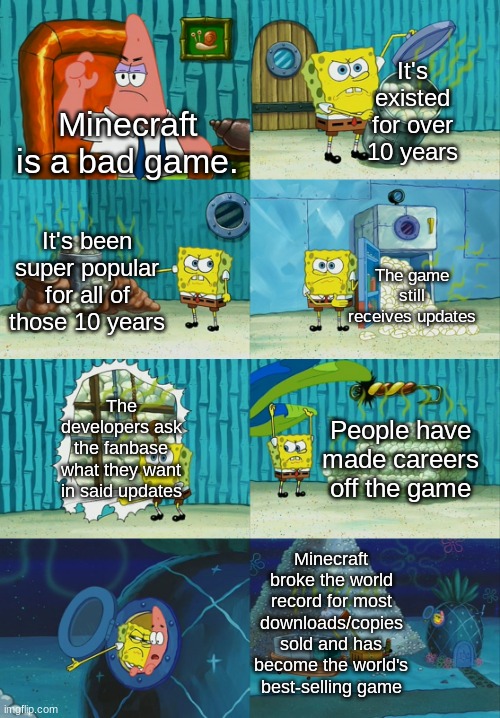
In order to click on trash can in this screenshot , I will do click(x=387, y=85).